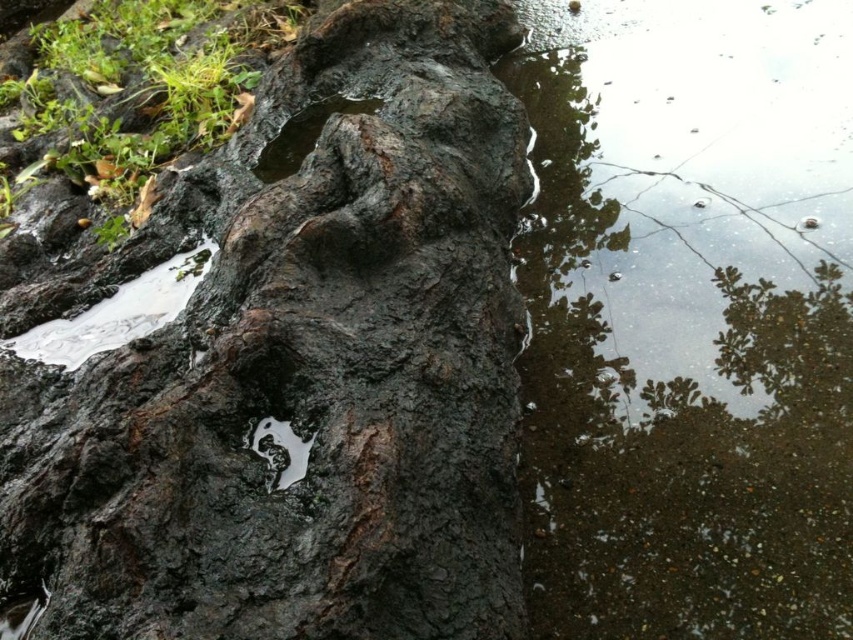
Between point (277, 72) and point (792, 456), which one is positioned in front?

Point (792, 456)

Is dark brown rough bark at center to the left of clear water at lower right from the viewer's perspective?

Yes, dark brown rough bark at center is to the left of clear water at lower right.

Which is behind, point (497, 372) or point (577, 84)?

The point (577, 84) is more distant.

You are a GUI agent. You are given a task and a screenshot of the screen. Output one action in this format:
    pyautogui.click(x=<x>, y=<y>)
    Task: Click on the dark brown rough bark at center
    
    Given the screenshot: What is the action you would take?
    pyautogui.click(x=291, y=365)

Does point (704, 528) come behind point (289, 470)?

Yes, it is behind point (289, 470).

Can you confirm if clear water at lower right is positioned below white glossy puddle at center?

Actually, clear water at lower right is above white glossy puddle at center.

What do you see at coordinates (688, 317) in the screenshot?
I see `clear water at lower right` at bounding box center [688, 317].

Locate an element on the screen. clear water at lower right is located at coordinates 688,317.

Does dark brown rough bark at center appear on the left side of white glossy puddle at center?

Correct, you'll find dark brown rough bark at center to the left of white glossy puddle at center.

How much distance is there between dark brown rough bark at center and white glossy puddle at center?

24.72 inches

Between point (194, 576) and point (268, 448), which one is positioned behind?

Point (268, 448)

Find the location of `dark brown rough bark at center`. dark brown rough bark at center is located at coordinates (291, 365).